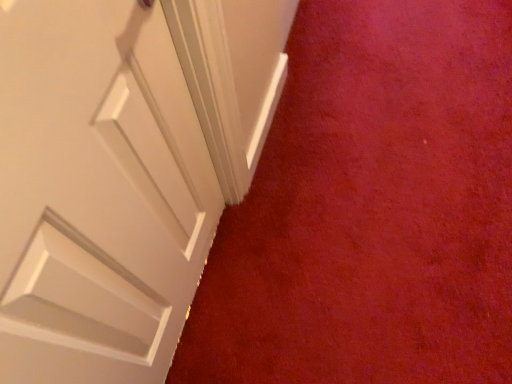
Question: Is white matte door at upper left oriented towards matte white door at upper left?

Choices:
 (A) no
 (B) yes

Answer: (A)

Question: Is white matte door at upper left taller than matte white door at upper left?

Choices:
 (A) yes
 (B) no

Answer: (A)

Question: From a real-world perspective, is white matte door at upper left located higher than matte white door at upper left?

Choices:
 (A) no
 (B) yes

Answer: (B)

Question: Is white matte door at upper left to the left of matte white door at upper left from the viewer's perspective?

Choices:
 (A) yes
 (B) no

Answer: (A)

Question: Is white matte door at upper left wider than matte white door at upper left?

Choices:
 (A) yes
 (B) no

Answer: (B)

Question: Is white matte door at upper left facing away from matte white door at upper left?

Choices:
 (A) no
 (B) yes

Answer: (A)

Question: Considering the relative sizes of matte white door at upper left and white matte door at upper left in the image provided, is matte white door at upper left taller than white matte door at upper left?

Choices:
 (A) no
 (B) yes

Answer: (A)

Question: Considering the relative positions of matte white door at upper left and white matte door at upper left in the image provided, is matte white door at upper left behind white matte door at upper left?

Choices:
 (A) yes
 (B) no

Answer: (A)

Question: Considering the relative positions of matte white door at upper left and white matte door at upper left in the image provided, is matte white door at upper left to the right of white matte door at upper left from the viewer's perspective?

Choices:
 (A) yes
 (B) no

Answer: (A)

Question: Is matte white door at upper left shorter than white matte door at upper left?

Choices:
 (A) yes
 (B) no

Answer: (A)

Question: Does matte white door at upper left have a smaller size compared to white matte door at upper left?

Choices:
 (A) yes
 (B) no

Answer: (B)

Question: Can you confirm if matte white door at upper left is bigger than white matte door at upper left?

Choices:
 (A) yes
 (B) no

Answer: (A)

Question: In the image, is matte white door at upper left on the left side or the right side of white matte door at upper left?

Choices:
 (A) right
 (B) left

Answer: (A)